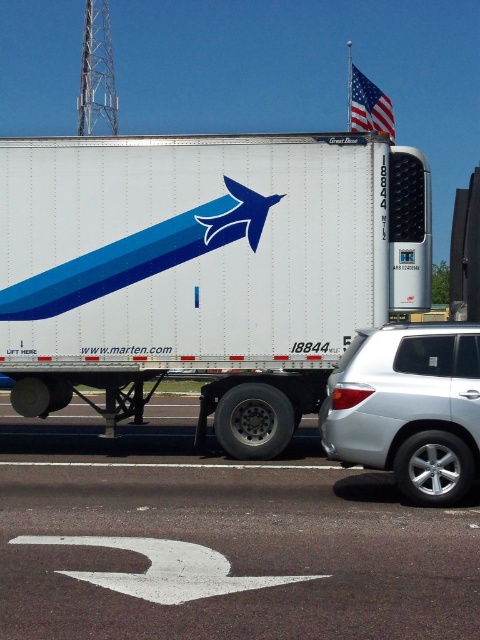
Can you confirm if white matte trailer at center is wider than white asphalt road at lower center?

Yes.

Between white matte trailer at center and white asphalt road at lower center, which one appears on the right side from the viewer's perspective?

From the viewer's perspective, white asphalt road at lower center appears more on the right side.

Identify the location of white matte trailer at center. The width and height of the screenshot is (480, 640). (204, 268).

Does white matte trailer at center have a smaller size compared to silver metallic suv at right?

No, white matte trailer at center is not smaller than silver metallic suv at right.

You are a GUI agent. You are given a task and a screenshot of the screen. Output one action in this format:
    pyautogui.click(x=<x>, y=<y>)
    Task: Click on the white matte trailer at center
    The width and height of the screenshot is (480, 640).
    Given the screenshot: What is the action you would take?
    pyautogui.click(x=204, y=268)

Who is positioned more to the right, white matte trailer at center or american flag at upper right?

Positioned to the right is american flag at upper right.

Can you confirm if white matte trailer at center is positioned above american flag at upper right?

No, white matte trailer at center is not above american flag at upper right.

The width and height of the screenshot is (480, 640). What do you see at coordinates (204, 268) in the screenshot? I see `white matte trailer at center` at bounding box center [204, 268].

Image resolution: width=480 pixels, height=640 pixels. Find the location of `white matte trailer at center`. white matte trailer at center is located at coordinates (204, 268).